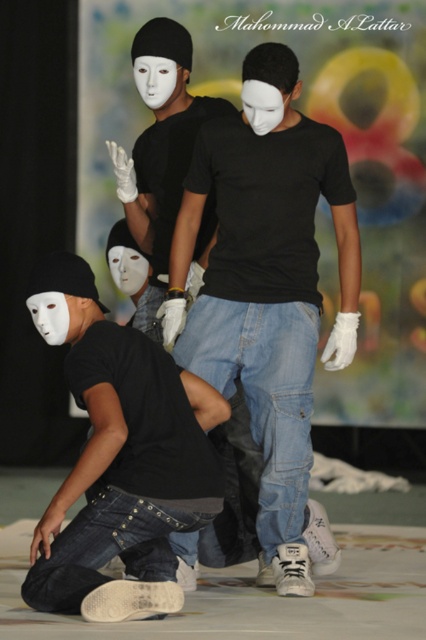
Which of these two, matte black shirt at center or matte black shirt at lower left, stands shorter?

matte black shirt at lower left

Who is taller, matte black shirt at center or matte black shirt at lower left?

Standing taller between the two is matte black shirt at center.

You are a GUI agent. You are given a task and a screenshot of the screen. Output one action in this format:
    pyautogui.click(x=<x>, y=<y>)
    Task: Click on the matte black shirt at center
    
    Given the screenshot: What is the action you would take?
    pyautogui.click(x=267, y=284)